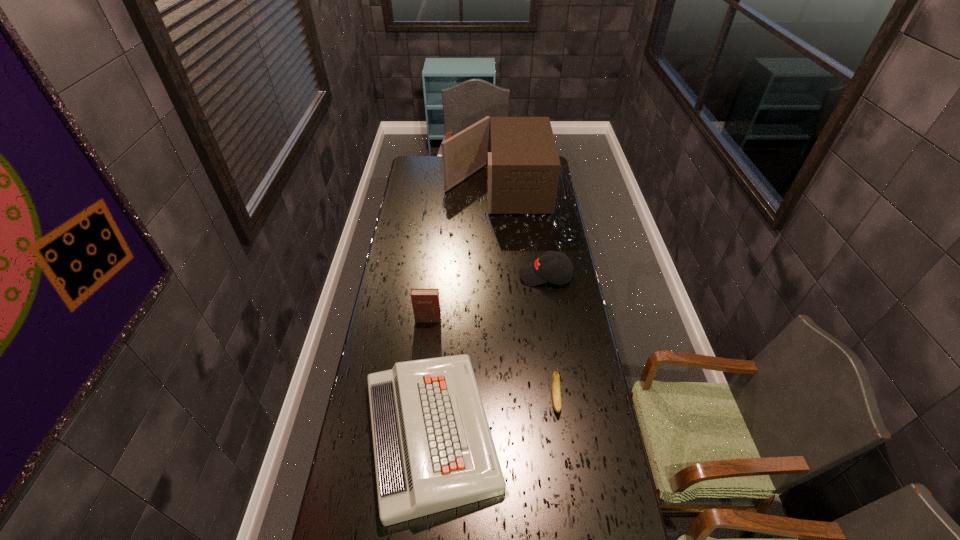
Find the location of a particular element. The width and height of the screenshot is (960, 540). the tallest object is located at coordinates (523, 170).

I want to click on the farthest object, so click(523, 170).

Find the location of a particular element. The height and width of the screenshot is (540, 960). diary is located at coordinates (426, 306).

The image size is (960, 540). What are the coordinates of `the third nearest object` in the screenshot? It's located at (426, 306).

Locate an element on the screen. The height and width of the screenshot is (540, 960). banana is located at coordinates (555, 383).

At what (x,y) coordinates should I click in order to perform the action: click on baseball cap. Please return your answer as a coordinate pair (x, y). The width and height of the screenshot is (960, 540). Looking at the image, I should click on (545, 268).

The image size is (960, 540). I want to click on the shortest object, so click(x=433, y=449).

This screenshot has width=960, height=540. Find the location of `vacant region located with the door open on the front of the tallest object`. vacant region located with the door open on the front of the tallest object is located at coordinates (404, 187).

Locate an element on the screen. free location located with the door open on the front of the tallest object is located at coordinates (432, 187).

The image size is (960, 540). I want to click on free point located with the door open on the front of the tallest object, so click(x=408, y=187).